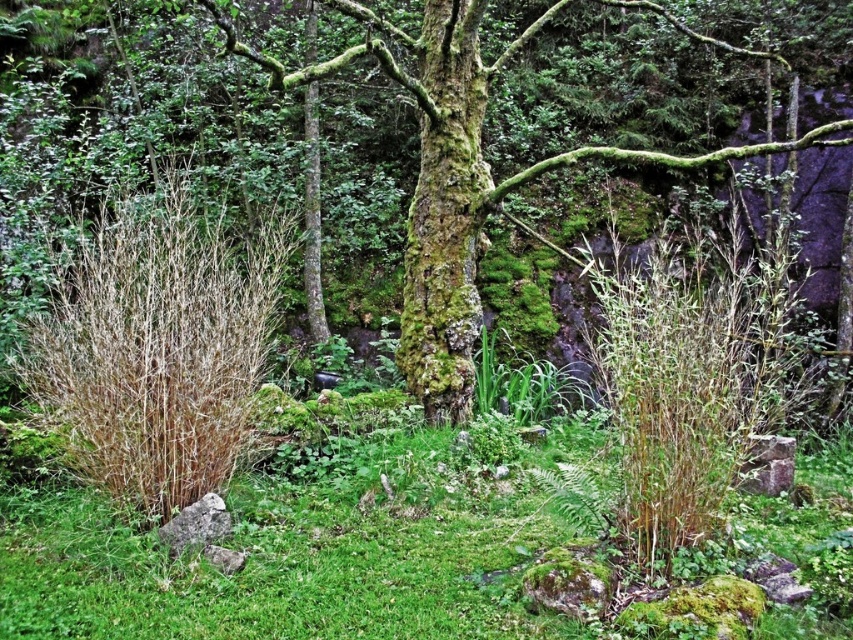
Is green mossy grass at center bigger than green mossy tree at center?

No, green mossy grass at center is not bigger than green mossy tree at center.

Identify the location of green mossy grass at center. (287, 557).

I want to click on green mossy grass at center, so click(x=287, y=557).

The image size is (853, 640). I want to click on green mossy grass at center, so click(287, 557).